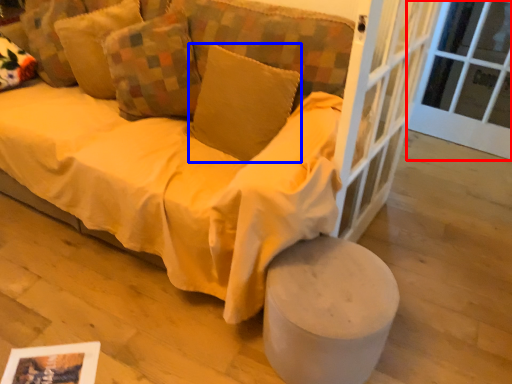
Question: Which of the following is the closest to the observer, window frame (highlighted by a red box) or pillow (highlighted by a blue box)?

Choices:
 (A) window frame
 (B) pillow

Answer: (B)